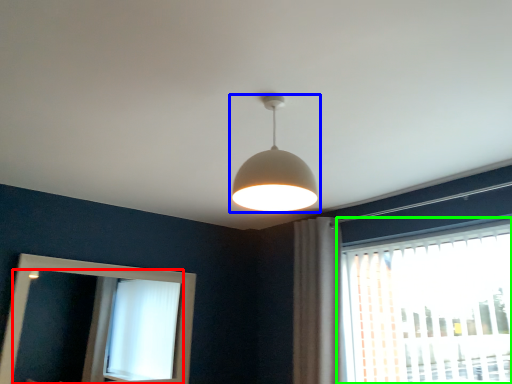
Question: Estimate the real-world distances between objects in this image. Which object is closer to mirror (highlighted by a red box), lamp (highlighted by a blue box) or window (highlighted by a green box)?

Choices:
 (A) lamp
 (B) window

Answer: (B)